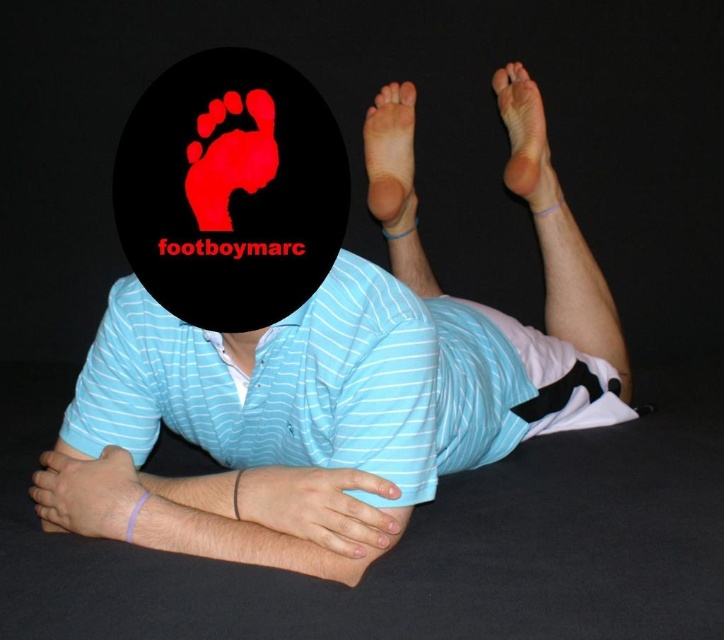
Question: Considering the real-world distances, which object is farthest from the smooth skin foot at upper right?

Choices:
 (A) smooth skin hand at center
 (B) smooth skin foot at upper center
 (C) light blue striped shirt at center
 (D) pale skin hand at lower left

Answer: (D)

Question: Can you confirm if smooth skin foot at upper center is bigger than smooth skin foot at upper right?

Choices:
 (A) yes
 (B) no

Answer: (B)

Question: Estimate the real-world distances between objects in this image. Which object is farther from the smooth skin foot at upper center?

Choices:
 (A) smooth skin hand at center
 (B) smooth skin foot at upper right
 (C) pale skin hand at lower left

Answer: (C)

Question: Which object is closer to the camera taking this photo?

Choices:
 (A) smooth skin hand at center
 (B) smooth skin foot at upper center
 (C) light blue striped shirt at center
 (D) smooth skin foot at upper right

Answer: (A)

Question: Observing the image, what is the correct spatial positioning of light blue striped shirt at center in reference to smooth skin foot at upper right?

Choices:
 (A) right
 (B) left

Answer: (B)

Question: Is smooth skin hand at center thinner than smooth skin foot at upper center?

Choices:
 (A) yes
 (B) no

Answer: (B)